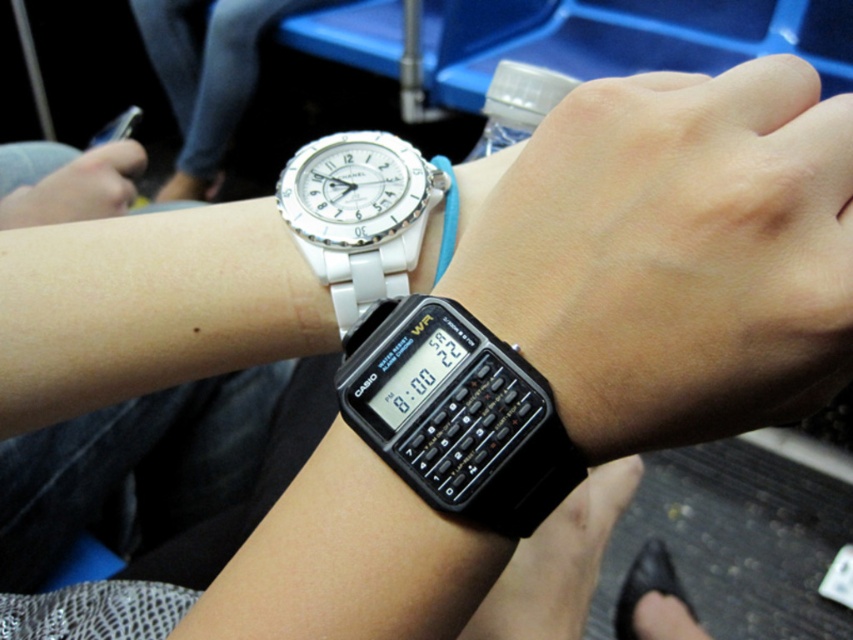
You are trying to calculate a math problem and need to reach for the black plastic calculator at lower center. However, there is a white ceramic watch at upper left in the way. Can you move the calculator without moving the watch?

The black plastic calculator at lower center is positioned on the right side of white ceramic watch at upper left, so you can move the calculator without moving the watch since it is not directly blocking the path.

You are a student who needs to use the black plastic calculator at lower center to solve a math problem. However, you want to check the time using the white ceramic watch at upper left. Can you reach the calculator without moving the watch?

The black plastic calculator at lower center is positioned under the white ceramic watch at upper left, so you can reach the calculator without moving the watch because it is located below it.

You are organizing a desk and need to place the black plastic calculator at lower center and the white ceramic watch at upper left. Which object takes up more space on the desk?

The white ceramic watch at upper left takes up more space on the desk than the black plastic calculator at lower center because the black plastic calculator at lower center occupies less space than white ceramic watch at upper left.